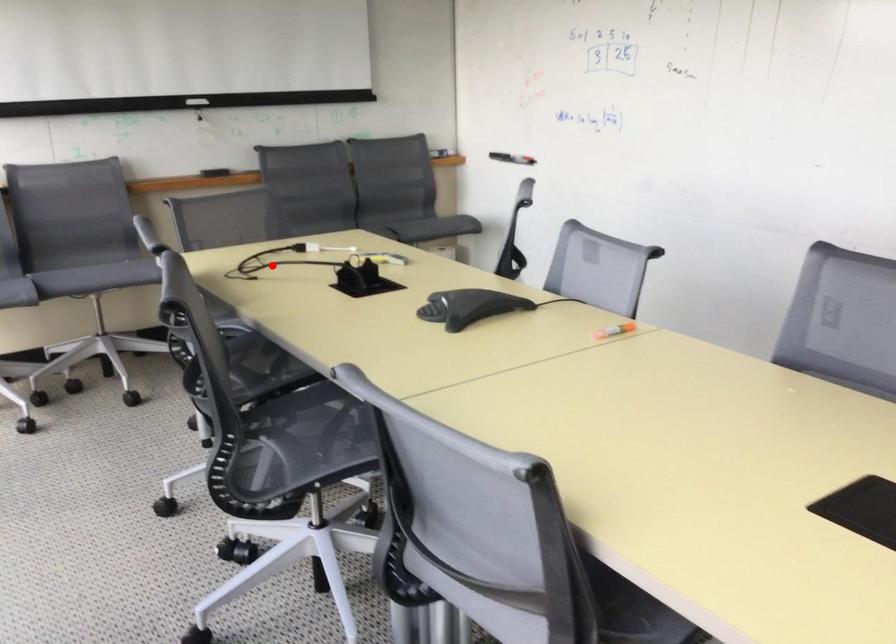
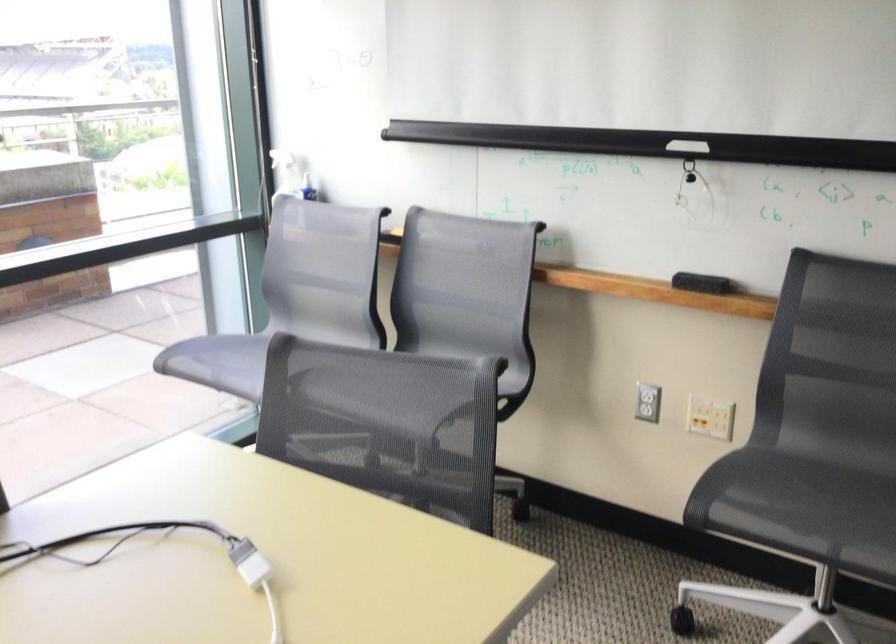
Question: I am providing you with two images of the same scene from different viewpoints. Image1 has a red point marked. In image2, the corresponding 3D location appears at what relative position? Reply with the corresponding letter.

Choices:
 (A) Closer
 (B) Farther

Answer: (A)